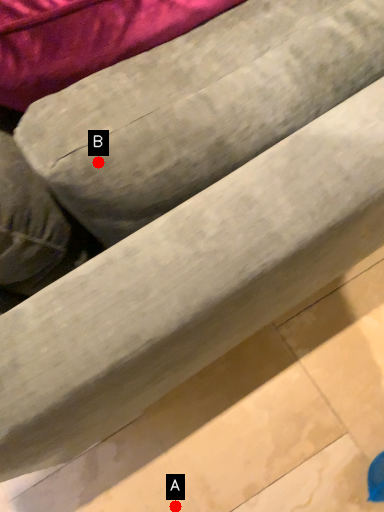
Question: Two points are circled on the image, labeled by A and B beside each circle. Which of the following is the farthest from the observer?

Choices:
 (A) A is further
 (B) B is further

Answer: (A)